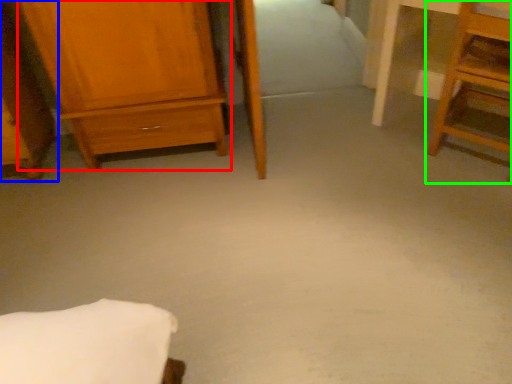
Question: Which is nearer to the chest of drawers (highlighted by a red box)? furniture (highlighted by a blue box) or furniture (highlighted by a green box).

Choices:
 (A) furniture
 (B) furniture

Answer: (A)